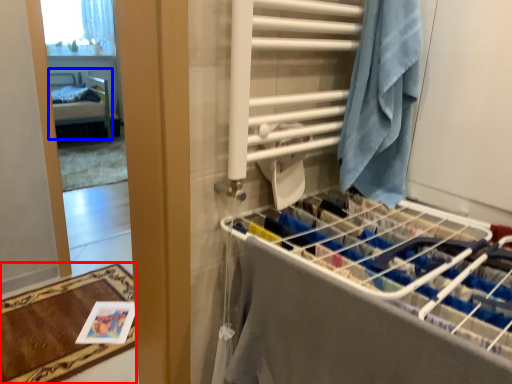
Question: Among these objects, which one is farthest to the camera, bath mat (highlighted by a red box) or furniture (highlighted by a blue box)?

Choices:
 (A) bath mat
 (B) furniture

Answer: (B)